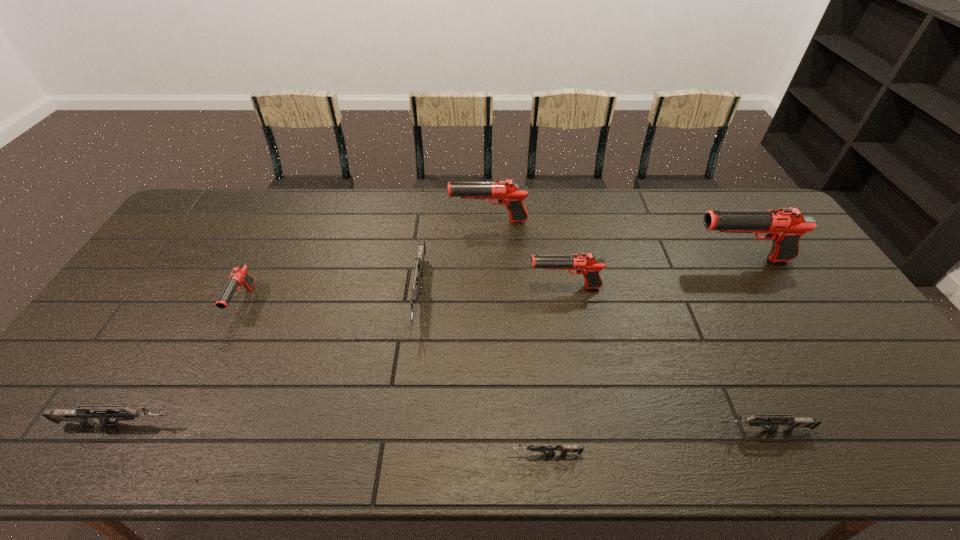
You are a GUI agent. You are given a task and a screenshot of the screen. Output one action in this format:
    pyautogui.click(x=<x>, y=<y>)
    Task: Click on the vacant space located at the aiming end of the farthest object
    This screenshot has width=960, height=540.
    Given the screenshot: What is the action you would take?
    pyautogui.click(x=355, y=221)

Find the location of a particular element. vacant region located at the aiming end of the third tallest gun is located at coordinates (492, 287).

The height and width of the screenshot is (540, 960). I want to click on vacant space located 0.260m at the aiming end of the third tallest gun, so click(443, 287).

Find the location of a particular element. vacant space positioned 0.270m at the aiming end of the third tallest gun is located at coordinates (439, 287).

Identify the location of vacant space located 0.250m at the aiming end of the leftmost black gun. The image size is (960, 540). (192, 408).

Find the location of a particular element. The height and width of the screenshot is (540, 960). vacant space located aimed along the barrel of the sixth gun from right to left is located at coordinates (411, 357).

At what (x,y) coordinates should I click in order to perform the action: click on vacant space located 0.320m aimed along the barrel of the sixth tallest gun. Please return your answer as a coordinate pair (x, y). This screenshot has width=960, height=540. Looking at the image, I should click on (316, 424).

Identify the location of free spot located aimed along the barrel of the seventh tallest gun. (620, 430).

Identify the location of free location located 0.220m aimed along the barrel of the seventh tallest gun. (620, 430).

The image size is (960, 540). In order to click on vacant region located aimed along the barrel of the seventh tallest gun in this screenshot , I will do `click(572, 430)`.